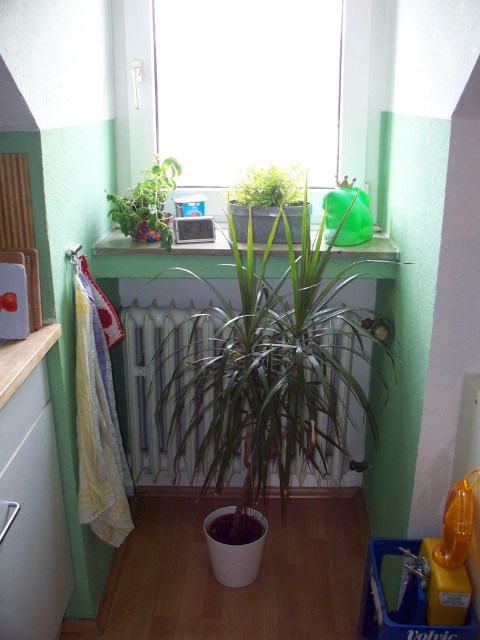
Who is positioned more to the left, green leafy plant at center or green plastic container at upper center?

From the viewer's perspective, green plastic container at upper center appears more on the left side.

Who is shorter, green leafy plant at center or green plastic container at upper center?

Standing shorter between the two is green plastic container at upper center.

Consider the image. Who is more forward, (175, 417) or (120, 250)?

Point (120, 250) is more forward.

Find the location of a particular element. green leafy plant at center is located at coordinates (269, 369).

Between white metallic radiator at center and green leafy plant at upper center, which one is positioned higher?

green leafy plant at upper center is above.

Can you confirm if white metallic radiator at center is thinner than green leafy plant at upper center?

No, white metallic radiator at center is not thinner than green leafy plant at upper center.

Between point (156, 307) and point (152, 232), which one is positioned behind?

Positioned behind is point (156, 307).

Find the location of `white metallic radiator at center`. white metallic radiator at center is located at coordinates (167, 374).

Does green leafy plant at center appear over green leafy plant at upper center?

Actually, green leafy plant at center is below green leafy plant at upper center.

Between point (303, 189) and point (151, 179), which one is positioned in front?

Point (303, 189) is more forward.

Find the location of a particular element. The height and width of the screenshot is (640, 480). green leafy plant at center is located at coordinates (269, 369).